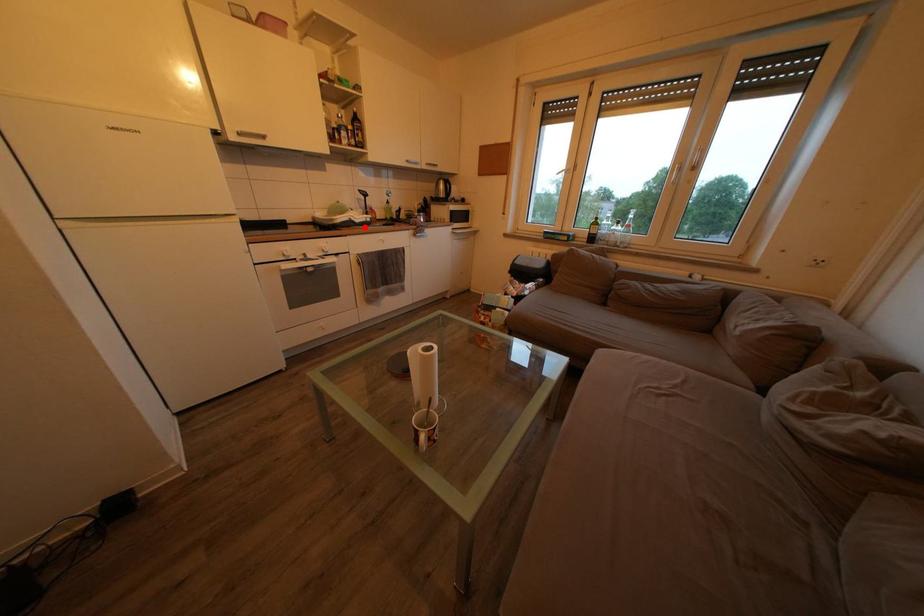
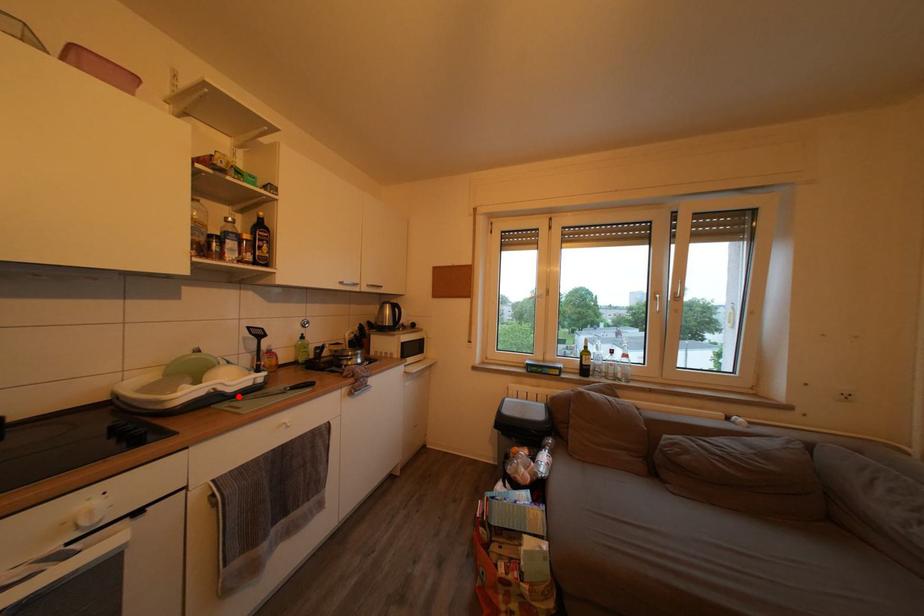
I am providing you with two images of the same scene from different viewpoints. A red point is marked on the first image and another point is marked on the second image. Are the points marked in image1 and image2 representing the same 3D position?

Yes